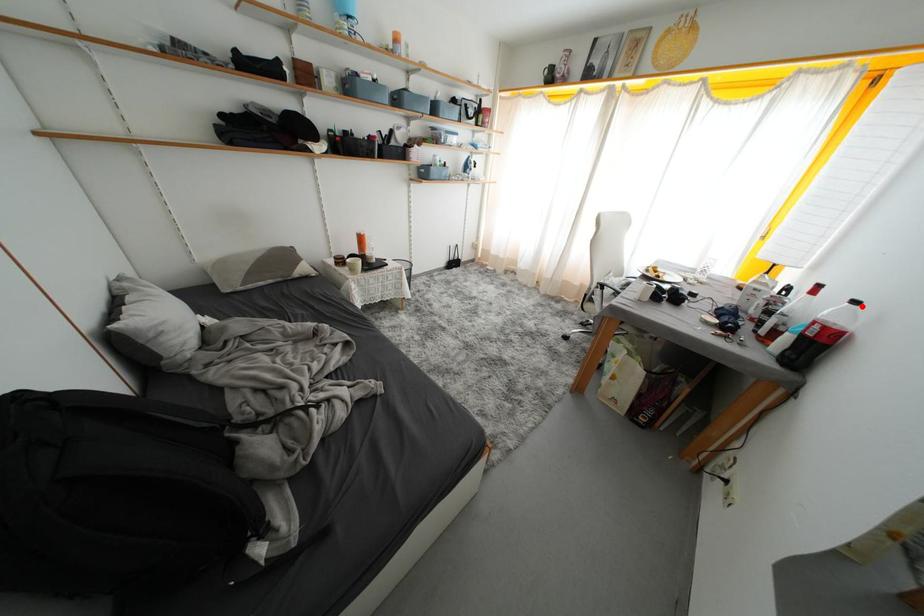
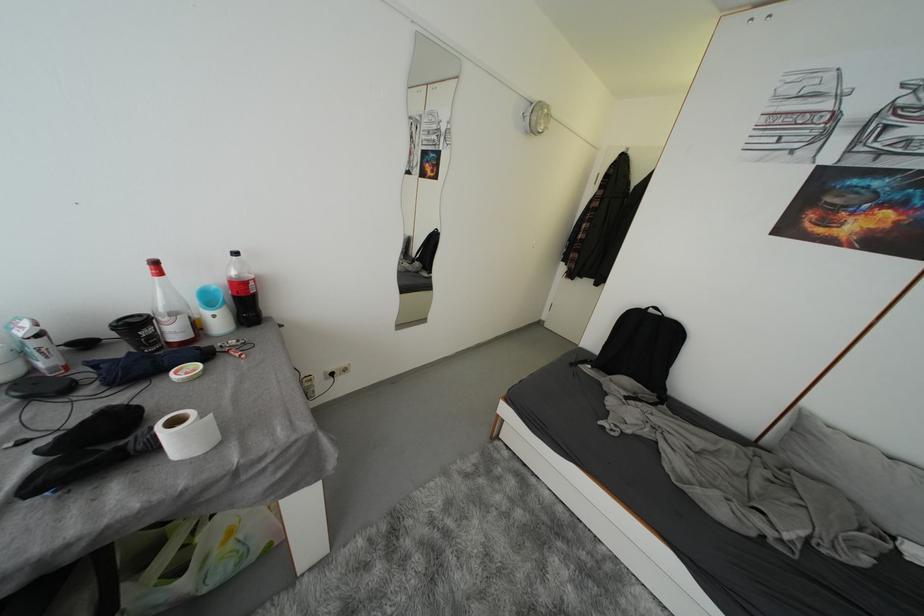
Where in the second image is the point corresponding to the highlighted location from the first image?

(242, 257)